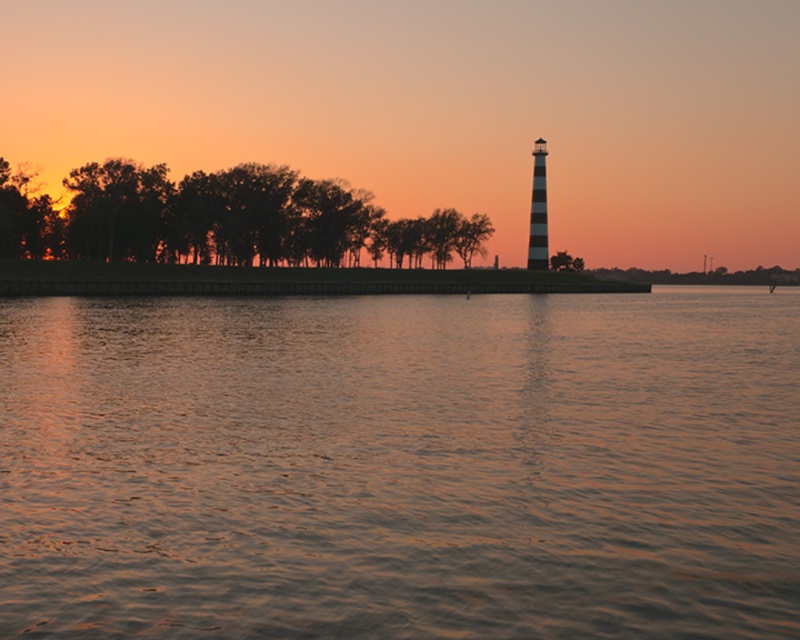
Question: Can you confirm if smooth water at center is positioned to the left of silhouette wood trees at left?

Choices:
 (A) yes
 (B) no

Answer: (B)

Question: Does smooth water at center lie behind silhouette wood trees at left?

Choices:
 (A) no
 (B) yes

Answer: (A)

Question: Does smooth water at center come behind silhouette wood trees at left?

Choices:
 (A) yes
 (B) no

Answer: (B)

Question: Which of the following is the closest to the observer?

Choices:
 (A) (136, 244)
 (B) (684, 416)

Answer: (B)